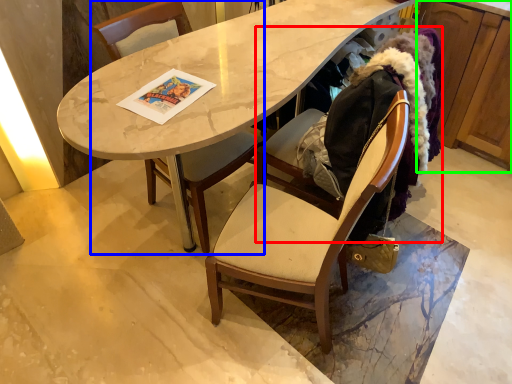
Question: Which object is the farthest from folding chair (highlighted by a red box)? Choose among these: chair (highlighted by a blue box) or cabinetry (highlighted by a green box).

Choices:
 (A) chair
 (B) cabinetry

Answer: (B)